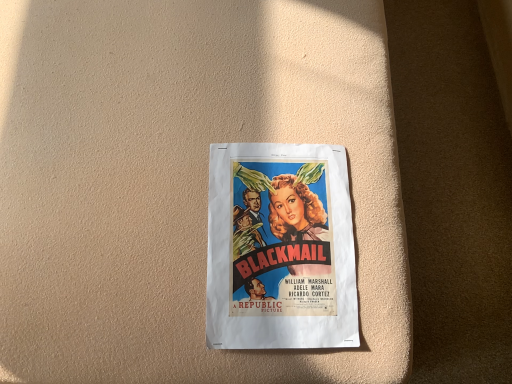
What is the approximate height of matte paper poster at center?

matte paper poster at center is 2.77 inches in height.

This screenshot has height=384, width=512. What do you see at coordinates (280, 248) in the screenshot? I see `matte paper poster at center` at bounding box center [280, 248].

The image size is (512, 384). What are the coordinates of `matte paper poster at center` in the screenshot? It's located at (280, 248).

Where is `matte paper poster at center`? Image resolution: width=512 pixels, height=384 pixels. matte paper poster at center is located at coordinates (280, 248).